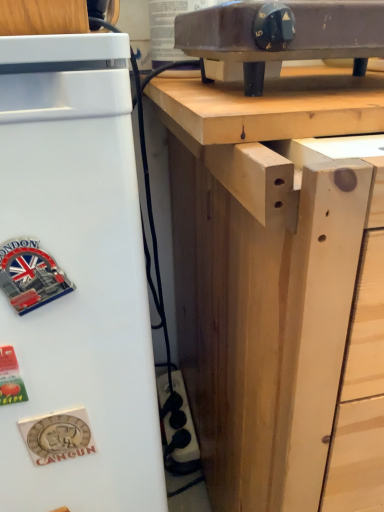
Where is `white matte refrigerator at left`? Image resolution: width=384 pixels, height=512 pixels. white matte refrigerator at left is located at coordinates (76, 278).

Describe the element at coordinates (274, 106) in the screenshot. I see `natural wood table at upper center` at that location.

This screenshot has width=384, height=512. I want to click on natural wood table at upper center, so click(x=274, y=106).

The height and width of the screenshot is (512, 384). Identify the location of matte black electric stove at upper center. (281, 34).

Measure the distance from natural wood desk at upper center to natural wood table at upper center.

The distance of natural wood desk at upper center from natural wood table at upper center is 5.11 inches.

Is natural wood desk at upper center turned away from natural wood table at upper center?

No, natural wood desk at upper center's orientation is not away from natural wood table at upper center.

From the picture: Considering the relative sizes of natural wood desk at upper center and natural wood table at upper center in the image provided, is natural wood desk at upper center smaller than natural wood table at upper center?

Incorrect, natural wood desk at upper center is not smaller in size than natural wood table at upper center.

Is natural wood desk at upper center at the right side of natural wood table at upper center?

Yes, natural wood desk at upper center is to the right of natural wood table at upper center.

Find the location of a particular element. The height and width of the screenshot is (512, 384). appliance behind the natural wood desk at upper center is located at coordinates coord(281,34).

Consider the image. Which is more to the right, natural wood desk at upper center or matte black electric stove at upper center?

Positioned to the right is natural wood desk at upper center.

From a real-world perspective, is natural wood desk at upper center physically above matte black electric stove at upper center?

No.

How many degrees apart are the facing directions of natural wood desk at upper center and matte black electric stove at upper center?

There is a 1.12-degree angle between the facing directions of natural wood desk at upper center and matte black electric stove at upper center.

Is natural wood table at upper center positioned beyond the bounds of white matte refrigerator at left?

Indeed, natural wood table at upper center is completely outside white matte refrigerator at left.

From a real-world perspective, is natural wood table at upper center located beneath white matte refrigerator at left?

No, from a real-world perspective, natural wood table at upper center is not beneath white matte refrigerator at left.

Which of these two, natural wood table at upper center or white matte refrigerator at left, stands shorter?

natural wood table at upper center.

Can you confirm if natural wood table at upper center is thinner than white matte refrigerator at left?

Incorrect, the width of natural wood table at upper center is not less than that of white matte refrigerator at left.

Is matte black electric stove at upper center next to natural wood table at upper center?

Absolutely, matte black electric stove at upper center is next to and touching natural wood table at upper center.

Consider the image. Is matte black electric stove at upper center taller or shorter than natural wood table at upper center?

matte black electric stove at upper center is taller than natural wood table at upper center.

Does matte black electric stove at upper center turn towards natural wood table at upper center?

No, matte black electric stove at upper center is not aimed at natural wood table at upper center.

From the image's perspective, does matte black electric stove at upper center appear lower than natural wood table at upper center?

No.

Considering the sizes of objects natural wood table at upper center and natural wood desk at upper center in the image provided, who is shorter, natural wood table at upper center or natural wood desk at upper center?

natural wood table at upper center is shorter.

Is natural wood table at upper center far away from natural wood desk at upper center?

No, natural wood table at upper center is not far away from natural wood desk at upper center.

Is natural wood table at upper center looking in the opposite direction of natural wood desk at upper center?

No, natural wood desk at upper center is not at the back of natural wood table at upper center.

Is point (333, 101) positioned after point (290, 189)?

Yes, point (333, 101) is behind point (290, 189).

Is white matte refrigerator at left turned away from natural wood desk at upper center?

No, white matte refrigerator at left's orientation is not away from natural wood desk at upper center.

At what (x,y) coordinates should I click in order to perform the action: click on desk that is on the right side of white matte refrigerator at left. Please return your answer as a coordinate pair (x, y). The image size is (384, 512). Looking at the image, I should click on (278, 307).

Which object is positioned more to the right, white matte refrigerator at left or natural wood desk at upper center?

Positioned to the right is natural wood desk at upper center.

Who is bigger, white matte refrigerator at left or natural wood desk at upper center?

With larger size is natural wood desk at upper center.

Is natural wood desk at upper center positioned behind white matte refrigerator at left?

No.

Is point (240, 317) more distant than point (59, 312)?

Yes.

Is natural wood desk at upper center wider than white matte refrigerator at left?

Correct, the width of natural wood desk at upper center exceeds that of white matte refrigerator at left.

Which is more to the left, natural wood desk at upper center or white matte refrigerator at left?

Positioned to the left is white matte refrigerator at left.

The width and height of the screenshot is (384, 512). What are the coordinates of `wood positioned vertically above the natural wood desk at upper center (from a real-world perspective)` in the screenshot? It's located at (274, 106).

You are a GUI agent. You are given a task and a screenshot of the screen. Output one action in this format:
    pyautogui.click(x=<x>, y=<y>)
    Task: Click on the appliance behind the natural wood desk at upper center
    The height and width of the screenshot is (512, 384).
    Given the screenshot: What is the action you would take?
    pyautogui.click(x=281, y=34)

From the image, which object appears to be farther from white matte refrigerator at left, natural wood table at upper center or natural wood desk at upper center?

natural wood table at upper center lies further to white matte refrigerator at left than the other object.

Based on the photo, estimate the real-world distances between objects in this image. Which object is closer to natural wood desk at upper center, matte black electric stove at upper center or white matte refrigerator at left?

white matte refrigerator at left is closer to natural wood desk at upper center.

Which object lies further to the anchor point natural wood desk at upper center, white matte refrigerator at left or natural wood table at upper center?

The object further to natural wood desk at upper center is white matte refrigerator at left.

When comparing their distances from natural wood desk at upper center, does natural wood table at upper center or white matte refrigerator at left seem closer?

natural wood table at upper center is closer to natural wood desk at upper center.

Looking at the image, which one is located further to natural wood desk at upper center, white matte refrigerator at left or matte black electric stove at upper center?

matte black electric stove at upper center lies further to natural wood desk at upper center than the other object.

When comparing their distances from white matte refrigerator at left, does natural wood desk at upper center or matte black electric stove at upper center seem further?

matte black electric stove at upper center is positioned further to the anchor white matte refrigerator at left.

In the scene shown: Estimate the real-world distances between objects in this image. Which object is closer to natural wood table at upper center, matte black electric stove at upper center or white matte refrigerator at left?

matte black electric stove at upper center is closer to natural wood table at upper center.

Looking at the image, which one is located further to natural wood table at upper center, matte black electric stove at upper center or natural wood desk at upper center?

natural wood desk at upper center is positioned further to the anchor natural wood table at upper center.

The height and width of the screenshot is (512, 384). I want to click on wood between matte black electric stove at upper center and white matte refrigerator at left vertically, so click(274, 106).

Identify the location of wood between matte black electric stove at upper center and natural wood desk at upper center vertically. The width and height of the screenshot is (384, 512). (274, 106).

In order to click on wood between white matte refrigerator at left and natural wood desk at upper center from left to right in this screenshot , I will do point(274,106).

The width and height of the screenshot is (384, 512). In order to click on appliance between white matte refrigerator at left and natural wood desk at upper center in this screenshot , I will do `click(281, 34)`.